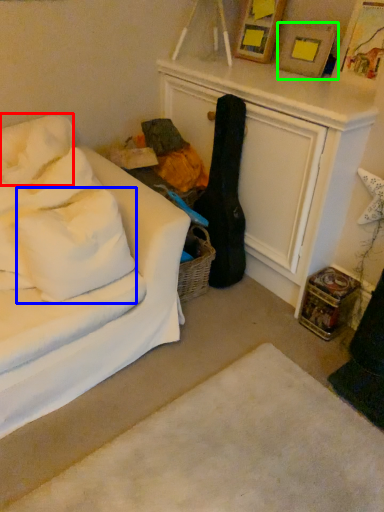
Question: Considering the real-world distances, which object is farthest from pillow (highlighted by a red box)? pillow (highlighted by a blue box) or picture frame (highlighted by a green box)?

Choices:
 (A) pillow
 (B) picture frame

Answer: (B)